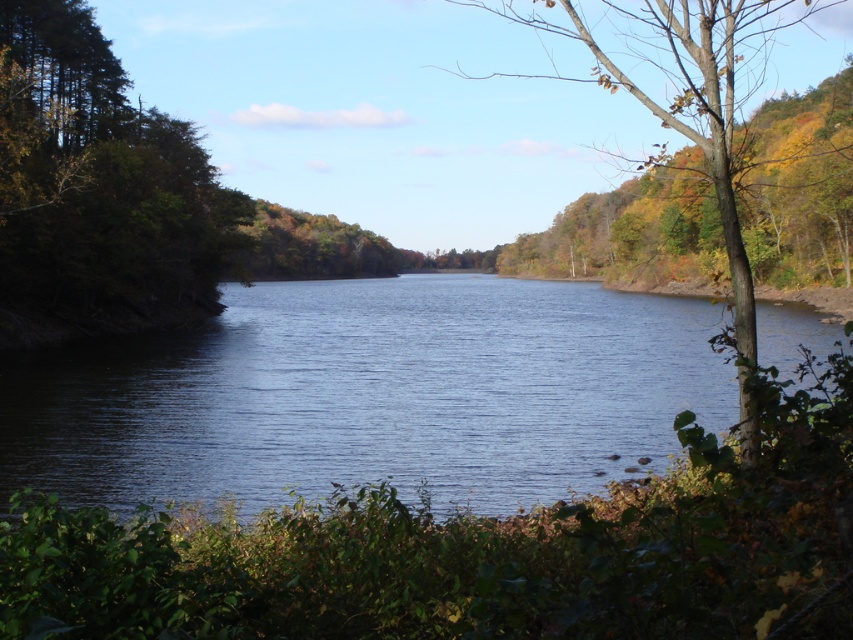
Between green matte tree at left and brown leafy tree at right, which one is positioned higher?

Positioned higher is brown leafy tree at right.

Who is positioned more to the left, green matte tree at left or brown leafy tree at right?

Positioned to the left is green matte tree at left.

Is point (97, 138) closer to camera compared to point (740, 3)?

No.

This screenshot has height=640, width=853. What are the coordinates of `green matte tree at left` in the screenshot? It's located at (97, 182).

Which is above, blue water at center or brown leafy tree at right?

brown leafy tree at right is above.

Is blue water at center above brown leafy tree at right?

No, blue water at center is not above brown leafy tree at right.

Who is more distant from viewer, (306, 388) or (631, 12)?

Point (631, 12)

Identify the location of blue water at center. (370, 396).

Consider the image. Measure the distance between blue water at center and green matte tree at left.

The distance of blue water at center from green matte tree at left is 14.89 meters.

Between blue water at center and green matte tree at left, which one has more height?

With more height is green matte tree at left.

Find the location of a particular element. Image resolution: width=853 pixels, height=640 pixels. blue water at center is located at coordinates (370, 396).